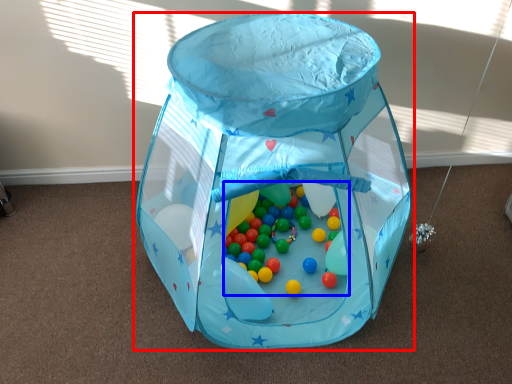
Question: Which object appears farthest to the camera in this image, toy (highlighted by a red box) or toy (highlighted by a blue box)?

Choices:
 (A) toy
 (B) toy

Answer: (B)